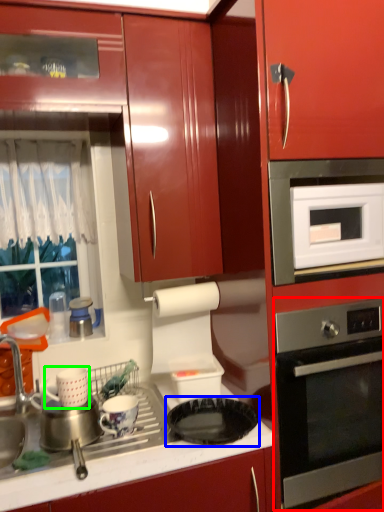
Question: Which object is the closest to the home appliance (highlighted by a red box)? Choose among these: gas stove (highlighted by a blue box) or appliance (highlighted by a green box).

Choices:
 (A) gas stove
 (B) appliance

Answer: (A)